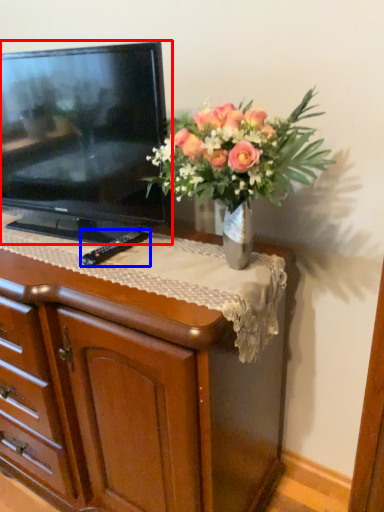
Question: Which object appears farthest to the camera in this image, television (highlighted by a red box) or remote (highlighted by a blue box)?

Choices:
 (A) television
 (B) remote

Answer: (B)